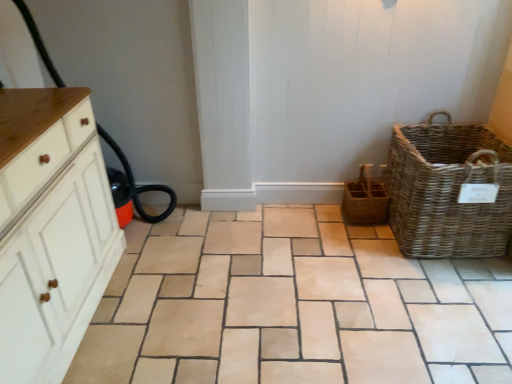
Question: Is natural stone tile at center wider or thinner than brown woven basket at center-right?

Choices:
 (A) wide
 (B) thin

Answer: (A)

Question: Considering the positions of natural stone tile at center and brown woven basket at center-right in the image, is natural stone tile at center taller or shorter than brown woven basket at center-right?

Choices:
 (A) short
 (B) tall

Answer: (A)

Question: Based on their relative distances, which object is nearer to the white wood cabinet at left?

Choices:
 (A) natural stone tile at center
 (B) natural woven picnic basket at right
 (C) brown woven basket at center-right

Answer: (A)

Question: Which object is the closest to the white wood cabinet at left?

Choices:
 (A) brown woven basket at center-right
 (B) natural woven picnic basket at right
 (C) natural stone tile at center

Answer: (C)